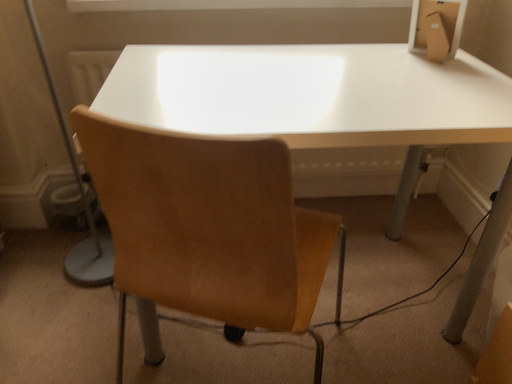
In order to click on white matte window frame at upper center in this screenshot , I will do `click(226, 4)`.

Locate an element on the screen. Image resolution: width=512 pixels, height=384 pixels. brown cardboard box at upper right is located at coordinates (442, 22).

In order to face brown cardboard box at upper right, should I rotate leftwards or rightwards?

You should look right and rotate roughly 23.411 degrees.

This screenshot has width=512, height=384. Find the location of `white matte window frame at upper center`. white matte window frame at upper center is located at coordinates (226, 4).

Which is behind, point (139, 69) or point (228, 276)?

The point (139, 69) is behind.

Is white glossy table at center smaller than light brown leather chair at center?

Incorrect, white glossy table at center is not smaller in size than light brown leather chair at center.

In the image, is white glossy table at center positioned in front of or behind light brown leather chair at center?

white glossy table at center is positioned farther from the viewer than light brown leather chair at center.

Is white glossy table at center inside or outside of light brown leather chair at center?

white glossy table at center cannot be found inside light brown leather chair at center.

Can you confirm if matte gray table lamp at left is wider than white matte window frame at upper center?

Correct, the width of matte gray table lamp at left exceeds that of white matte window frame at upper center.

Is matte gray table lamp at left directly adjacent to white matte window frame at upper center?

No, matte gray table lamp at left is not making contact with white matte window frame at upper center.

Between point (54, 103) and point (234, 0), which one is positioned in front?

The point (54, 103) is in front.

From the image's perspective, which is below, matte gray table lamp at left or white matte window frame at upper center?

matte gray table lamp at left appears lower in the image.

In the scene shown: From the image's perspective, which is above, brown cardboard box at upper right or light brown leather chair at center?

brown cardboard box at upper right, from the image's perspective.

How much distance is there between brown cardboard box at upper right and light brown leather chair at center?

brown cardboard box at upper right is 33.13 inches from light brown leather chair at center.

Does brown cardboard box at upper right appear on the right side of light brown leather chair at center?

Indeed, brown cardboard box at upper right is positioned on the right side of light brown leather chair at center.

Is brown cardboard box at upper right far away from light brown leather chair at center?

No.

From the image's perspective, is white glossy table at center above or below white matte window frame at upper center?

white glossy table at center is below white matte window frame at upper center.

Locate an element on the screen. The image size is (512, 384). table in front of the white matte window frame at upper center is located at coordinates (311, 94).

Is white glossy table at center beside white matte window frame at upper center?

No.

Which object is wider, white glossy table at center or white matte window frame at upper center?

Wider between the two is white glossy table at center.

Locate an element on the screen. This screenshot has width=512, height=384. chair in front of the white glossy table at center is located at coordinates (209, 228).

Is light brown leather chair at center positioned before white glossy table at center?

Yes, it is.

Do you think light brown leather chair at center is within white glossy table at center, or outside of it?

light brown leather chair at center lies within the bounds of white glossy table at center.

Considering the positions of point (286, 246) and point (94, 277), is point (286, 246) closer or farther from the camera than point (94, 277)?

Point (286, 246) is closer to the camera than point (94, 277).

Considering the sizes of objects light brown leather chair at center and matte gray table lamp at left in the image provided, who is smaller, light brown leather chair at center or matte gray table lamp at left?

matte gray table lamp at left is smaller.

Is light brown leather chair at center beside matte gray table lamp at left?

light brown leather chair at center and matte gray table lamp at left are not in contact.

Which object is further away from the camera taking this photo, light brown leather chair at center or matte gray table lamp at left?

matte gray table lamp at left is behind.

Would you say brown cardboard box at upper right contains white matte window frame at upper center?

No, white matte window frame at upper center is not surrounded by brown cardboard box at upper right.

Is brown cardboard box at upper right to the left or to the right of white matte window frame at upper center in the image?

Based on their positions, brown cardboard box at upper right is located to the right of white matte window frame at upper center.

Is brown cardboard box at upper right wider or thinner than white matte window frame at upper center?

Clearly, brown cardboard box at upper right has less width compared to white matte window frame at upper center.

Is brown cardboard box at upper right positioned with its back to white matte window frame at upper center?

brown cardboard box at upper right is not turned away from white matte window frame at upper center.

In the image, there is a light brown leather chair at center. At what (x,y) coordinates should I click in order to perform the action: click on table below it (from a real-world perspective). Please return your answer as a coordinate pair (x, y). Looking at the image, I should click on (311, 94).

I want to click on window frame above the matte gray table lamp at left (from the image's perspective), so click(226, 4).

Based on their spatial positions, is matte gray table lamp at left or light brown leather chair at center further from white matte window frame at upper center?

The object further to white matte window frame at upper center is light brown leather chair at center.

Which object lies further to the anchor point light brown leather chair at center, matte gray table lamp at left or white glossy table at center?

Among the two, matte gray table lamp at left is located further to light brown leather chair at center.

Based on their spatial positions, is light brown leather chair at center or brown cardboard box at upper right closer to white matte window frame at upper center?

The object closer to white matte window frame at upper center is brown cardboard box at upper right.

Considering their positions, is white glossy table at center positioned closer to light brown leather chair at center than brown cardboard box at upper right?

Among the two, white glossy table at center is located nearer to light brown leather chair at center.

From the image, which object appears to be farther from light brown leather chair at center, white matte window frame at upper center or matte gray table lamp at left?

white matte window frame at upper center.

Considering their positions, is white matte window frame at upper center positioned closer to light brown leather chair at center than white glossy table at center?

The object closer to light brown leather chair at center is white glossy table at center.

From the image, which object appears to be nearer to matte gray table lamp at left, white glossy table at center or light brown leather chair at center?

white glossy table at center is closer to matte gray table lamp at left.

Considering their positions, is light brown leather chair at center positioned further to matte gray table lamp at left than white matte window frame at upper center?

Based on the image, light brown leather chair at center appears to be further to matte gray table lamp at left.

The height and width of the screenshot is (384, 512). Identify the location of cardboard box positioned between light brown leather chair at center and white matte window frame at upper center from near to far. (442, 22).

Find the location of `table lamp positioned between light brown leather chair at center and white matte window frame at upper center from near to far`. table lamp positioned between light brown leather chair at center and white matte window frame at upper center from near to far is located at coordinates (81, 198).

In order to click on window frame located between matte gray table lamp at left and brown cardboard box at upper right in the left-right direction in this screenshot , I will do `click(226, 4)`.

Locate an element on the screen. The width and height of the screenshot is (512, 384). chair between matte gray table lamp at left and brown cardboard box at upper right in the horizontal direction is located at coordinates (209, 228).